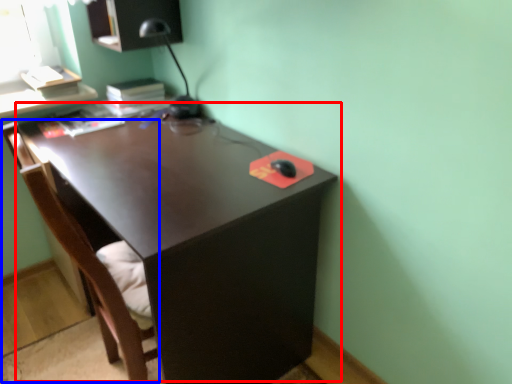
Question: Which object appears farthest to the camera in this image, desk (highlighted by a red box) or swivel chair (highlighted by a blue box)?

Choices:
 (A) desk
 (B) swivel chair

Answer: (A)